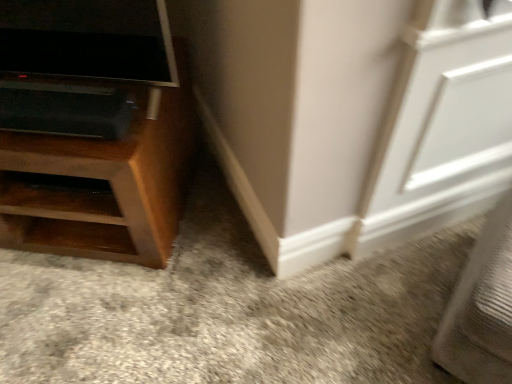
Question: Can you confirm if wooden cabinet at left is bigger than white matte screen door at upper right?

Choices:
 (A) no
 (B) yes

Answer: (B)

Question: From a real-world perspective, is wooden cabinet at left on top of white matte screen door at upper right?

Choices:
 (A) yes
 (B) no

Answer: (B)

Question: Does wooden cabinet at left have a lesser width compared to white matte screen door at upper right?

Choices:
 (A) yes
 (B) no

Answer: (B)

Question: Is wooden cabinet at left shorter than white matte screen door at upper right?

Choices:
 (A) yes
 (B) no

Answer: (A)

Question: Can you confirm if wooden cabinet at left is positioned to the left of white matte screen door at upper right?

Choices:
 (A) no
 (B) yes

Answer: (B)

Question: Is wooden cabinet at left turned away from white matte screen door at upper right?

Choices:
 (A) yes
 (B) no

Answer: (B)

Question: Is white matte screen door at upper right at the left side of wooden cabinet at left?

Choices:
 (A) yes
 (B) no

Answer: (B)

Question: Is the depth of white matte screen door at upper right less than that of wooden cabinet at left?

Choices:
 (A) no
 (B) yes

Answer: (B)

Question: From a real-world perspective, does white matte screen door at upper right sit lower than wooden cabinet at left?

Choices:
 (A) yes
 (B) no

Answer: (B)

Question: Is white matte screen door at upper right bigger than wooden cabinet at left?

Choices:
 (A) no
 (B) yes

Answer: (A)

Question: Is white matte screen door at upper right facing towards wooden cabinet at left?

Choices:
 (A) no
 (B) yes

Answer: (A)

Question: From the image's perspective, would you say white matte screen door at upper right is positioned over wooden cabinet at left?

Choices:
 (A) no
 (B) yes

Answer: (A)

Question: From a real-world perspective, is wooden cabinet at left above or below white matte screen door at upper right?

Choices:
 (A) above
 (B) below

Answer: (B)